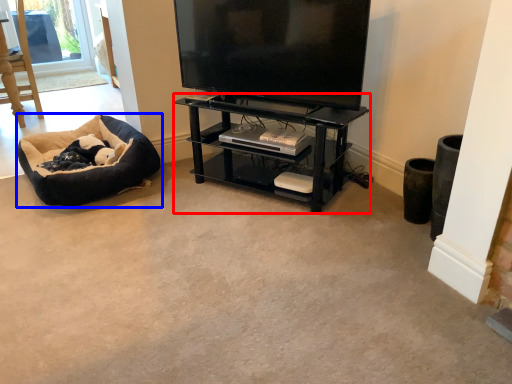
Question: Which object appears closest to the camera in this image, shelf (highlighted by a red box) or dog bed (highlighted by a blue box)?

Choices:
 (A) shelf
 (B) dog bed

Answer: (A)